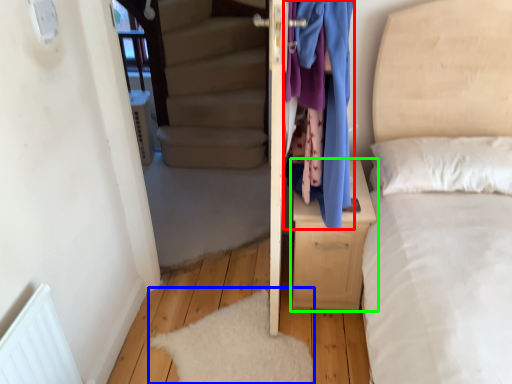
Question: Considering the real-world distances, which object is farthest from clothing (highlighted by a red box)? mat (highlighted by a blue box) or nightstand (highlighted by a green box)?

Choices:
 (A) mat
 (B) nightstand

Answer: (A)